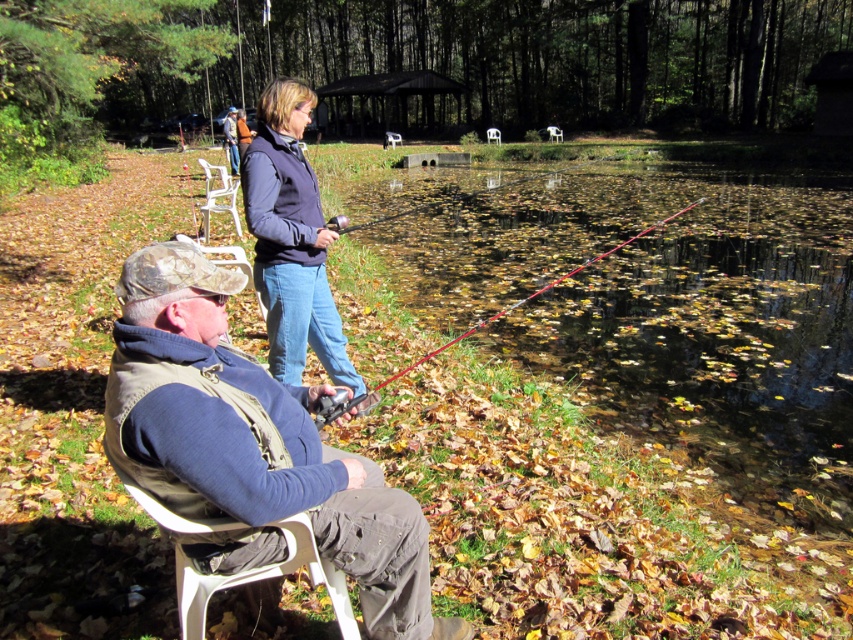
Question: Which point is closer to the camera taking this photo?

Choices:
 (A) (573, 164)
 (B) (196, 234)
 (C) (225, 204)

Answer: (B)

Question: Does smooth plastic fishing pole at center have a smaller size compared to white plastic chair at upper center?

Choices:
 (A) yes
 (B) no

Answer: (B)

Question: Where is camouflage fabric hat at lower left located in relation to matte red fishing pole at upper center in the image?

Choices:
 (A) right
 (B) left

Answer: (A)

Question: Can you confirm if red fiberglass rod at center is positioned to the left of matte red fishing pole at upper center?

Choices:
 (A) no
 (B) yes

Answer: (A)

Question: Which of these objects is positioned farthest from the smooth plastic fishing pole at center?

Choices:
 (A) camouflage fabric hat at lower left
 (B) white plastic chair at upper center
 (C) white plastic chair at lower left
 (D) red fiberglass rod at center

Answer: (B)

Question: Which object is the farthest from the matte red fishing pole at upper center?

Choices:
 (A) smooth plastic fishing pole at center
 (B) white plastic chair at lower left
 (C) navy blue fleece at upper center

Answer: (A)